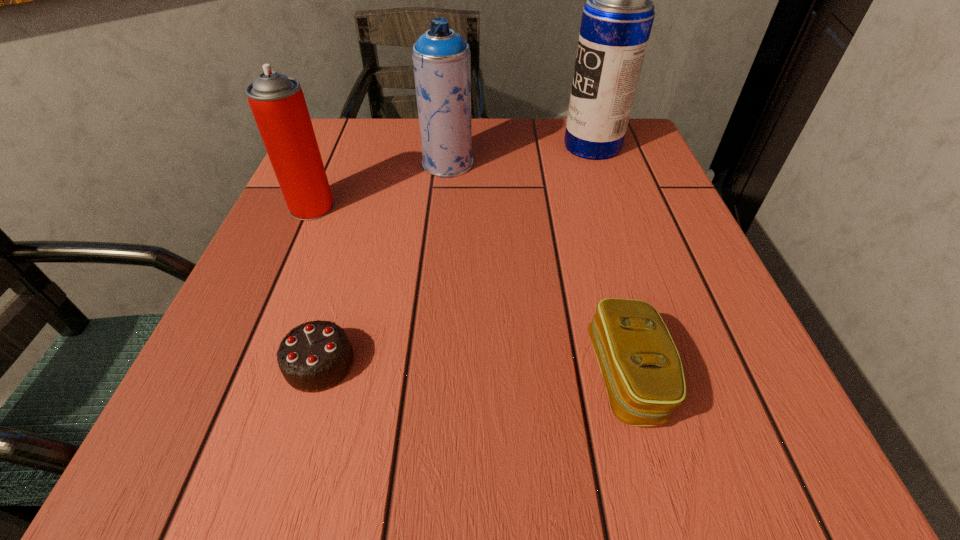
Where is `object that is the second closest to the leftmost object`? Image resolution: width=960 pixels, height=540 pixels. object that is the second closest to the leftmost object is located at coordinates (315, 356).

Find the location of a particular element. object that is the second closest to the third object from left to right is located at coordinates (617, 19).

Identify the location of aerosol can that is the closest one to the leftmost aerosol can. This screenshot has height=540, width=960. (441, 57).

Identify the location of the third closest aerosol can to the chocolate cake. This screenshot has height=540, width=960. tap(617, 19).